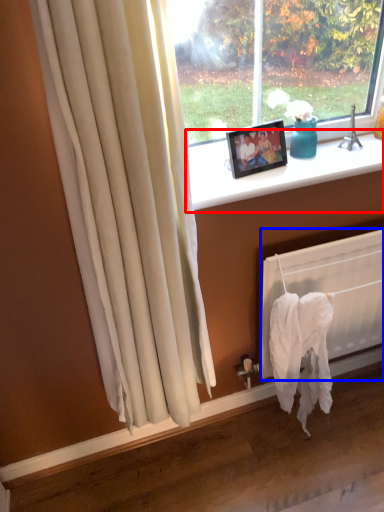
Question: Which of the following is the closest to the observer, window sill (highlighted by a red box) or radiator (highlighted by a blue box)?

Choices:
 (A) window sill
 (B) radiator

Answer: (A)